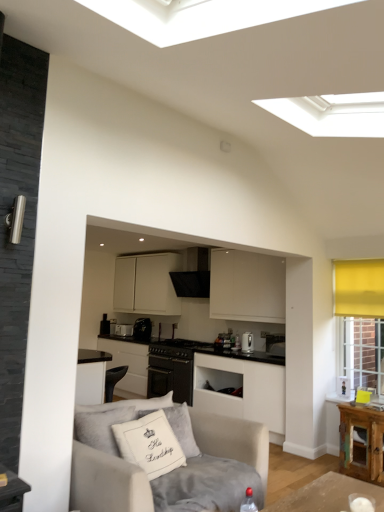
What is the approximate width of black matte stove at center, arranged as the 2th appliance when viewed from the right?

The width of black matte stove at center, arranged as the 2th appliance when viewed from the right, is 29.43 inches.

What do you see at coordinates (243, 390) in the screenshot? The width and height of the screenshot is (384, 512). I see `white matte cabinet at center, which is the 2th cabinetry in bottom-to-top order` at bounding box center [243, 390].

Measure the distance between point (200,293) and camera.

Point (200,293) is 19.27 feet away from camera.

Describe the element at coordinates (247, 342) in the screenshot. This screenshot has width=384, height=512. I see `satin silver kettle at center, the 1th appliance when ordered from front to back` at that location.

Find the location of a particular element. satin black toaster at center, marked as the first appliance in a back-to-front arrangement is located at coordinates (124, 329).

What do you see at coordinates (124, 329) in the screenshot? I see `satin black toaster at center, acting as the first appliance starting from the left` at bounding box center [124, 329].

What do you see at coordinates (113, 381) in the screenshot? The image size is (384, 512). I see `black leather armchair at lower center` at bounding box center [113, 381].

Image resolution: width=384 pixels, height=512 pixels. I want to click on black matte stove at center, which is the 3th appliance in back-to-front order, so click(177, 348).

Considering the relative sizes of white matte cabinet at center, which is the 3th cabinetry in bottom-to-top order, and white matte cabinet at center, marked as the 2th cabinetry in a top-to-bottom arrangement, in the image provided, is white matte cabinet at center, which is the 3th cabinetry in bottom-to-top order, smaller than white matte cabinet at center, marked as the 2th cabinetry in a top-to-bottom arrangement,?

Yes.

Could you tell me if white matte cabinet at center, which is the 3th cabinetry in bottom-to-top order, is facing white matte cabinet at center, which is the 2th cabinetry in bottom-to-top order?

No, white matte cabinet at center, which is the 3th cabinetry in bottom-to-top order, does not turn towards white matte cabinet at center, which is the 2th cabinetry in bottom-to-top order.

Can you confirm if white matte cabinet at center, which is the 3th cabinetry in bottom-to-top order, is taller than white matte cabinet at center, which is the 2th cabinetry in bottom-to-top order?

Yes, white matte cabinet at center, which is the 3th cabinetry in bottom-to-top order, is taller than white matte cabinet at center, which is the 2th cabinetry in bottom-to-top order.

Consider the image. Is white matte cabinet at center, the first cabinetry in the top-to-bottom sequence, positioned far away from black textured exhaust hood at center?

No.

From a real-world perspective, relative to black textured exhaust hood at center, is white matte cabinet at center, the first cabinetry in the top-to-bottom sequence, vertically above or below?

Clearly, from a real-world perspective, white matte cabinet at center, the first cabinetry in the top-to-bottom sequence, is below black textured exhaust hood at center.

Who is taller, white matte cabinet at center, the first cabinetry in the top-to-bottom sequence, or black textured exhaust hood at center?

white matte cabinet at center, the first cabinetry in the top-to-bottom sequence.

You are a GUI agent. You are given a task and a screenshot of the screen. Output one action in this format:
    pyautogui.click(x=<x>, y=<y>)
    Task: Click on the armchair on the left of white matte cabinet at center, which is the 2th cabinetry in bottom-to-top order
    Image resolution: width=384 pixels, height=512 pixels.
    Given the screenshot: What is the action you would take?
    pyautogui.click(x=113, y=381)

In the scene shown: Is white matte cabinet at center, which is the 2th cabinetry in bottom-to-top order, aimed at black leather armchair at lower center?

Yes, white matte cabinet at center, which is the 2th cabinetry in bottom-to-top order, is turned towards black leather armchair at lower center.

Which of these two, white matte cabinet at center, which is the 2th cabinetry in bottom-to-top order, or black leather armchair at lower center, is wider?

white matte cabinet at center, which is the 2th cabinetry in bottom-to-top order, is wider.

Is white matte cabinet at center, which is the 2th cabinetry in bottom-to-top order, inside or outside of black leather armchair at lower center?

white matte cabinet at center, which is the 2th cabinetry in bottom-to-top order, lies outside black leather armchair at lower center.

From the image's perspective, which is below, satin silver kettle at center, the 1th appliance when ordered from front to back, or light gray fabric couch at lower left?

light gray fabric couch at lower left appears lower in the image.

From a real-world perspective, which is physically above, satin silver kettle at center, marked as the 4th appliance in a left-to-right arrangement, or light gray fabric couch at lower left?

satin silver kettle at center, marked as the 4th appliance in a left-to-right arrangement, is physically above.

Is satin silver kettle at center, marked as the 4th appliance in a left-to-right arrangement, not near light gray fabric couch at lower left?

Yes, satin silver kettle at center, marked as the 4th appliance in a left-to-right arrangement, and light gray fabric couch at lower left are quite far apart.

Find the location of a particular element. studio couch located underneath the satin silver kettle at center, marked as the 4th appliance in a left-to-right arrangement (from a real-world perspective) is located at coordinates (107, 482).

From a real-world perspective, between black matte oven at center, the first cabinetry when ordered from bottom to top, and white matte cabinet at center, which is the 2th cabinetry in bottom-to-top order, who is vertically higher?

In real-world perspective, white matte cabinet at center, which is the 2th cabinetry in bottom-to-top order, is above.

Is black matte oven at center, which is the 3th cabinetry from top to bottom, oriented towards white matte cabinet at center, which is the 2th cabinetry in bottom-to-top order?

No, black matte oven at center, which is the 3th cabinetry from top to bottom, is not aimed at white matte cabinet at center, which is the 2th cabinetry in bottom-to-top order.

Considering the sizes of black matte oven at center, the first cabinetry when ordered from bottom to top, and white matte cabinet at center, marked as the 2th cabinetry in a top-to-bottom arrangement, in the image, is black matte oven at center, the first cabinetry when ordered from bottom to top, wider or thinner than white matte cabinet at center, marked as the 2th cabinetry in a top-to-bottom arrangement,?

Considering their sizes, black matte oven at center, the first cabinetry when ordered from bottom to top, looks broader than white matte cabinet at center, marked as the 2th cabinetry in a top-to-bottom arrangement.

Does point (186, 348) lie in front of point (200, 375)?

No, it is not.

From the image's perspective, would you say black matte stove at center, which is the 3th appliance in back-to-front order, is positioned over white matte cabinet at center, which is the 2th cabinetry in bottom-to-top order?

Correct, black matte stove at center, which is the 3th appliance in back-to-front order, appears higher than white matte cabinet at center, which is the 2th cabinetry in bottom-to-top order, in the image.

Which of these two, black matte stove at center, the second appliance when ordered from front to back, or white matte cabinet at center, which is the 2th cabinetry in bottom-to-top order, stands taller?

Standing taller between the two is white matte cabinet at center, which is the 2th cabinetry in bottom-to-top order.

How many degrees apart are the facing directions of black matte stove at center, arranged as the 2th appliance when viewed from the right, and white matte cabinet at center, which is the 2th cabinetry in bottom-to-top order?

The angle between the facing direction of black matte stove at center, arranged as the 2th appliance when viewed from the right, and the facing direction of white matte cabinet at center, which is the 2th cabinetry in bottom-to-top order, is 0.772 degrees.

In the image, is satin black toaster at center, marked as the first appliance in a back-to-front arrangement, positioned in front of or behind black leather armchair at lower center?

satin black toaster at center, marked as the first appliance in a back-to-front arrangement, is positioned farther from the viewer than black leather armchair at lower center.

Can you tell me how much satin black toaster at center, marked as the first appliance in a back-to-front arrangement, and black leather armchair at lower center differ in facing direction?

38.6 degrees separate the facing orientations of satin black toaster at center, marked as the first appliance in a back-to-front arrangement, and black leather armchair at lower center.

Looking at this image, is satin black toaster at center, which is the fourth appliance from right to left, directly adjacent to black leather armchair at lower center?

No.

Can you confirm if satin black toaster at center, acting as the first appliance starting from the left, is bigger than black leather armchair at lower center?

No, satin black toaster at center, acting as the first appliance starting from the left, is not bigger than black leather armchair at lower center.

Locate an element on the screen. cabinetry located above the white matte cabinet at center, which is the 2th cabinetry in bottom-to-top order (from the image's perspective) is located at coordinates (146, 284).

From the image's perspective, starting from the black textured exhaust hood at center, which cabinetry is the 1st one below? Please provide its 2D coordinates.

[(146, 284)]

Which object lies further to the anchor point light gray fabric couch at lower left, satin silver kettle at center, marked as the 4th appliance in a back-to-front arrangement, or black plastic coffee maker at center, which appears as the 3th appliance when viewed from the right?

The object further to light gray fabric couch at lower left is black plastic coffee maker at center, which appears as the 3th appliance when viewed from the right.

When comparing their distances from black matte stove at center, the second appliance when ordered from front to back, does white matte cabinet at center, marked as the 2th cabinetry in a top-to-bottom arrangement, or satin silver kettle at center, marked as the 4th appliance in a left-to-right arrangement, seem further?

satin silver kettle at center, marked as the 4th appliance in a left-to-right arrangement, is positioned further to the anchor black matte stove at center, the second appliance when ordered from front to back.

Based on the photo, when comparing their distances from black leather armchair at lower center, does light gray fabric couch at lower left or white matte cabinet at center, the first cabinetry in the top-to-bottom sequence, seem further?

light gray fabric couch at lower left.

Looking at the image, which one is located closer to satin silver kettle at center, which is counted as the 1th appliance, starting from the right, white matte cabinet at center, which is the 2th cabinetry in bottom-to-top order, or white matte cabinet at center, which is the 3th cabinetry in bottom-to-top order?

white matte cabinet at center, which is the 2th cabinetry in bottom-to-top order, is positioned closer to the anchor satin silver kettle at center, which is counted as the 1th appliance, starting from the right.

Estimate the real-world distances between objects in this image. Which object is closer to black matte stove at center, arranged as the 2th appliance when viewed from the right, black leather armchair at lower center or white matte cabinet at center, which is the 2th cabinetry in bottom-to-top order?

white matte cabinet at center, which is the 2th cabinetry in bottom-to-top order, lies closer to black matte stove at center, arranged as the 2th appliance when viewed from the right, than the other object.

Considering their positions, is satin black toaster at center, marked as the first appliance in a back-to-front arrangement, positioned closer to light gray fabric couch at lower left than black leather armchair at lower center?

Among the two, black leather armchair at lower center is located nearer to light gray fabric couch at lower left.

Considering their positions, is black matte oven at center, which is the 3th cabinetry from top to bottom, positioned further to white matte cabinet at center, marked as the 2th cabinetry in a top-to-bottom arrangement, than black leather armchair at lower center?

Based on the image, black leather armchair at lower center appears to be further to white matte cabinet at center, marked as the 2th cabinetry in a top-to-bottom arrangement.

Looking at the image, which one is located further to black textured exhaust hood at center, white matte cabinet at center, which is the 3th cabinetry in bottom-to-top order, or satin black toaster at center, marked as the first appliance in a back-to-front arrangement?

satin black toaster at center, marked as the first appliance in a back-to-front arrangement.

This screenshot has width=384, height=512. Find the location of `exhaust hood positioned between light gray fabric couch at lower left and black matte oven at center, which is the 3th cabinetry from top to bottom, from near to far`. exhaust hood positioned between light gray fabric couch at lower left and black matte oven at center, which is the 3th cabinetry from top to bottom, from near to far is located at coordinates (193, 275).

Locate an element on the screen. The height and width of the screenshot is (512, 384). armchair between white matte cabinet at center, marked as the 2th cabinetry in a top-to-bottom arrangement, and black plastic coffee maker at center, arranged as the second appliance when viewed from the left, in the front-back direction is located at coordinates (113, 381).

Find the location of `exhaust hood between black matte stove at center, arranged as the 2th appliance when viewed from the right, and satin black toaster at center, acting as the first appliance starting from the left, from front to back`. exhaust hood between black matte stove at center, arranged as the 2th appliance when viewed from the right, and satin black toaster at center, acting as the first appliance starting from the left, from front to back is located at coordinates (193, 275).

I want to click on armchair between white matte cabinet at center, marked as the 2th cabinetry in a top-to-bottom arrangement, and satin black toaster at center, which is the 4th appliance in front-to-back order, in the front-back direction, so click(113, 381).